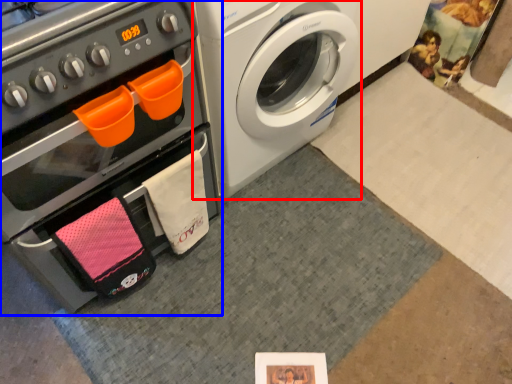
Question: Which object is further to the camera taking this photo, washing machine (highlighted by a red box) or oven (highlighted by a blue box)?

Choices:
 (A) washing machine
 (B) oven

Answer: (A)